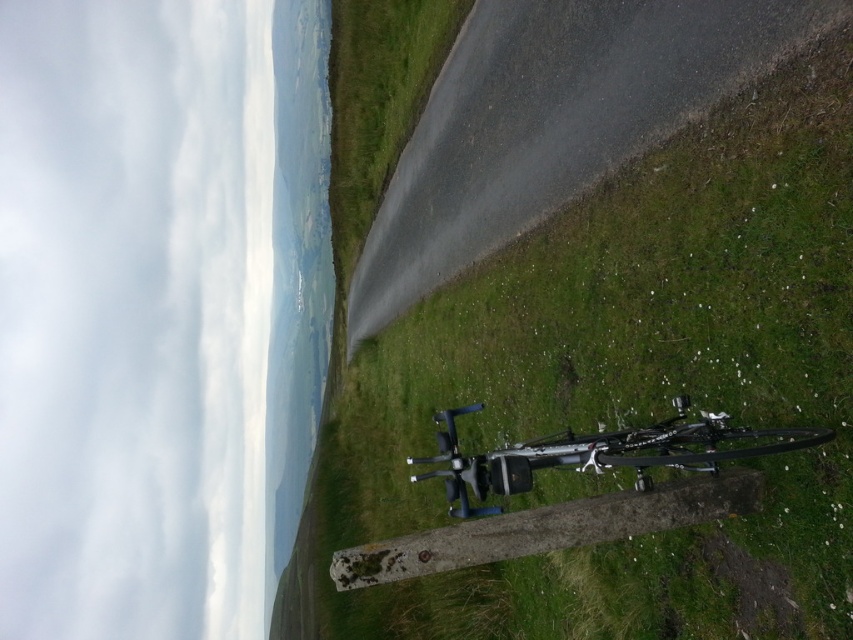
Question: Which of the following is the closest to the observer?

Choices:
 (A) (519, 451)
 (B) (677, 93)

Answer: (A)

Question: Which object appears closest to the camera in this image?

Choices:
 (A) green grass at lower right
 (B) metallic silver drone at center

Answer: (B)

Question: Is green grass at lower right bigger than metallic silver drone at center?

Choices:
 (A) yes
 (B) no

Answer: (A)

Question: Which of the following is the farthest from the observer?

Choices:
 (A) (514, 60)
 (B) (647, 458)

Answer: (A)

Question: Can you confirm if green grass at lower right is positioned below metallic silver drone at center?

Choices:
 (A) yes
 (B) no

Answer: (B)

Question: Is green grass at lower right positioned behind metallic silver drone at center?

Choices:
 (A) no
 (B) yes

Answer: (B)